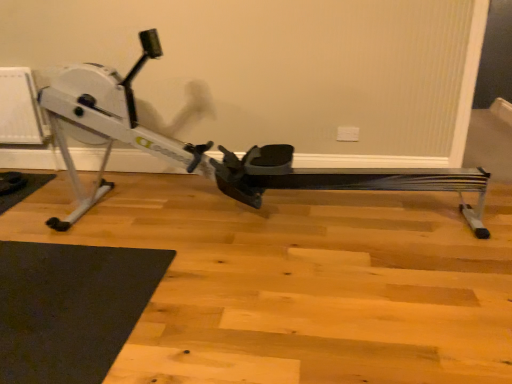
Question: Should I look upward or downward to see white plastic radiator at left?

Choices:
 (A) down
 (B) up

Answer: (B)